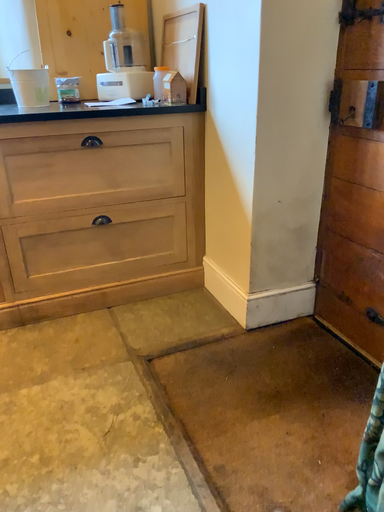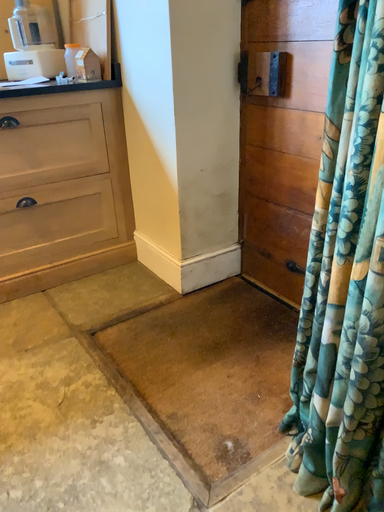
Question: How did the camera likely rotate when shooting the video?

Choices:
 (A) rotated right
 (B) rotated left

Answer: (A)